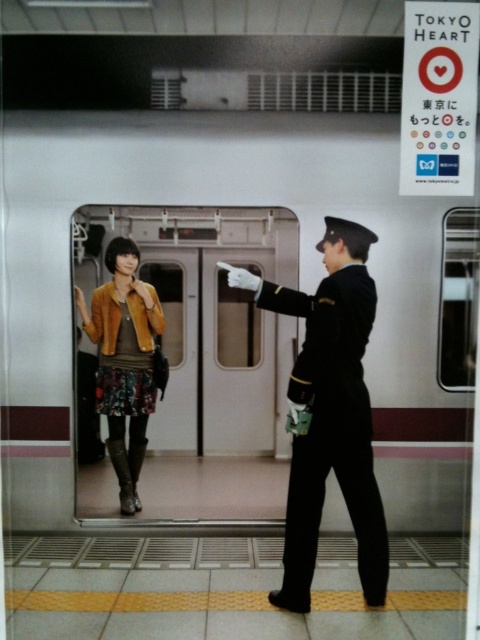
Question: Is metallic silver train at center bigger than velvet brown jacket at center?

Choices:
 (A) yes
 (B) no

Answer: (A)

Question: In this image, where is metallic silver train at center located relative to black wool uniform at right?

Choices:
 (A) left
 (B) right

Answer: (A)

Question: Which point is closer to the camera?

Choices:
 (A) (9, 204)
 (B) (153, 321)
 (C) (299, 499)

Answer: (C)

Question: Is black wool uniform at right positioned behind velvet brown jacket at center?

Choices:
 (A) no
 (B) yes

Answer: (A)

Question: Which of the following is the closest to the observer?

Choices:
 (A) metallic silver train at center
 (B) velvet brown jacket at center

Answer: (A)

Question: Which point is closer to the camera?

Choices:
 (A) black wool uniform at right
 (B) velvet brown jacket at center
 (C) metallic silver train at center

Answer: (A)